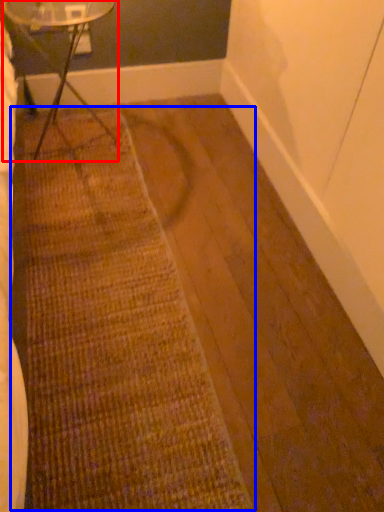
Question: Which of the following is the farthest to the observer, table (highlighted by a red box) or doormat (highlighted by a blue box)?

Choices:
 (A) table
 (B) doormat

Answer: (A)